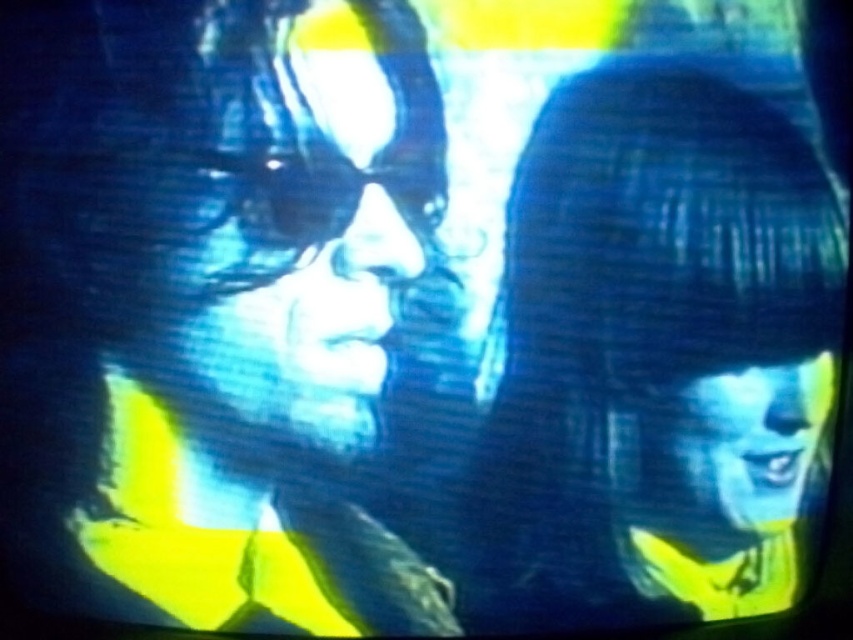
Does matte black hair at right appear under matte blue face at left?

Yes.

Between point (495, 394) and point (190, 317), which one is positioned behind?

Point (495, 394)

Is point (614, 100) positioned in front of point (223, 76)?

Yes, point (614, 100) is closer to viewer.

In order to click on matte black hair at right in this screenshot , I will do `click(654, 355)`.

Can you confirm if matte blue face at left is shorter than matte black goggles at center?

No.

Measure the distance between matte blue face at left and matte black goggles at center.

matte blue face at left and matte black goggles at center are 5.49 centimeters apart from each other.

In order to click on matte blue face at left in this screenshot , I will do `click(306, 220)`.

Describe the element at coordinates (654, 355) in the screenshot. I see `matte black hair at right` at that location.

Is point (730, 294) behind point (338, 166)?

Yes, point (730, 294) is behind point (338, 166).

Describe the element at coordinates (654, 355) in the screenshot. I see `matte black hair at right` at that location.

This screenshot has width=853, height=640. Find the location of `matte black hair at right`. matte black hair at right is located at coordinates (654, 355).